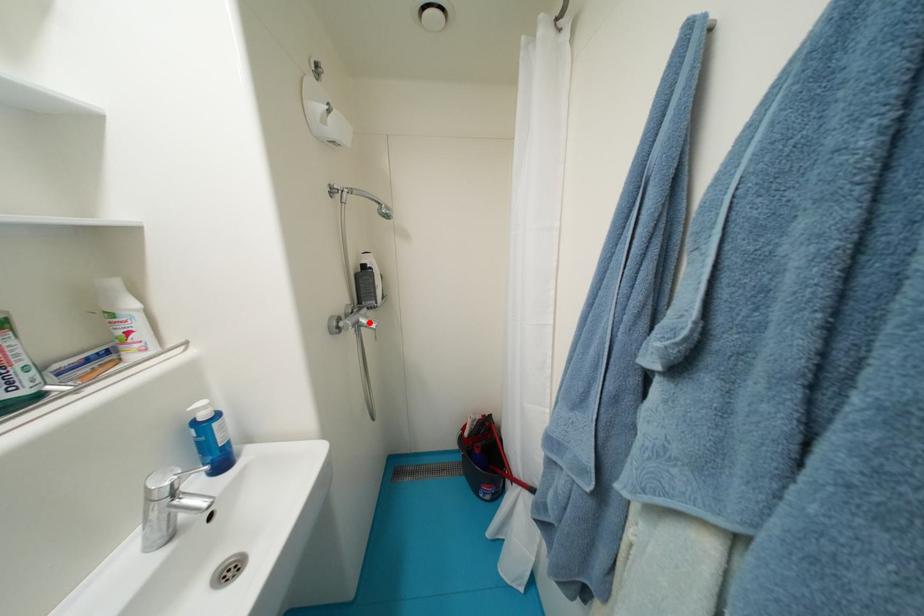
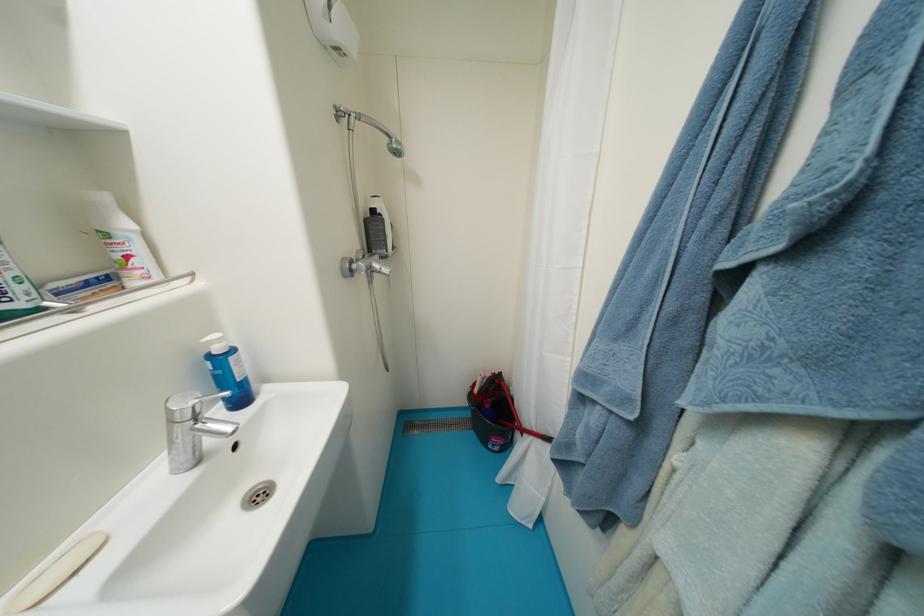
Where in the second image is the point corresponding to the highlighted location from the first image?

(383, 267)